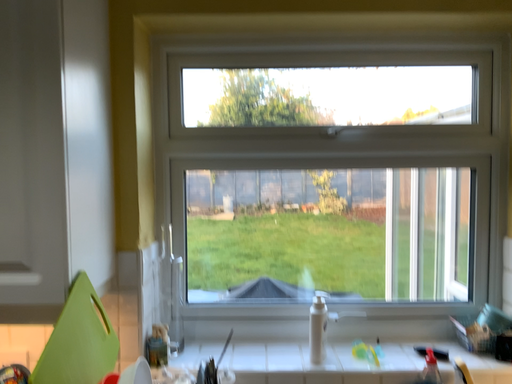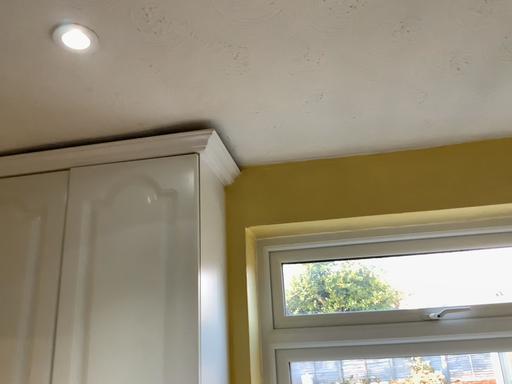
Question: How did the camera likely rotate when shooting the video?

Choices:
 (A) rotated downward
 (B) rotated upward

Answer: (B)